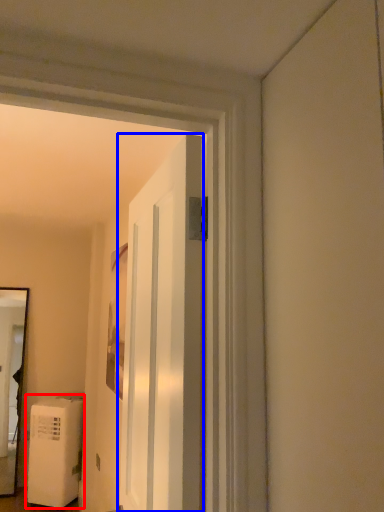
Question: Among these objects, which one is nearest to the camera, water heater (highlighted by a red box) or door (highlighted by a blue box)?

Choices:
 (A) water heater
 (B) door

Answer: (B)